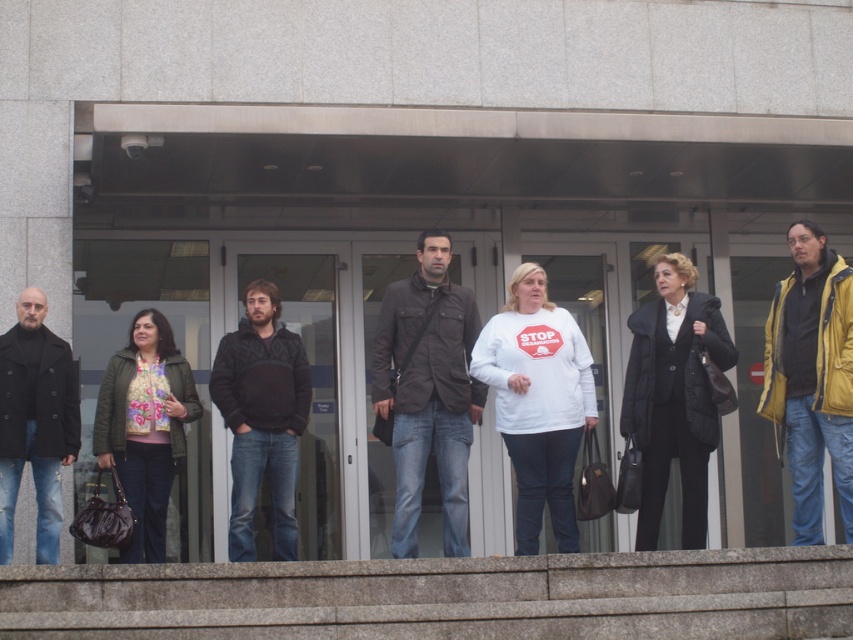
Question: Among these points, which one is nearest to the camera?

Choices:
 (A) (242, 435)
 (B) (131, 362)
 (C) (779, 332)

Answer: (C)

Question: Is matte brown jacket at center positioned before floral-patterned fabric top at center?

Choices:
 (A) no
 (B) yes

Answer: (A)

Question: Which point appears farthest from the camera in this image?

Choices:
 (A) (556, 500)
 (B) (134, 436)
 (C) (4, 396)
 (D) (271, 316)

Answer: (D)

Question: Can you confirm if black fleece at center is positioned below black wool coat at left?

Choices:
 (A) no
 (B) yes

Answer: (B)

Question: Based on their relative distances, which object is nearer to the black fleece at center?

Choices:
 (A) floral-patterned fabric top at center
 (B) yellow matte jacket at right
 (C) matte brown jacket at center
 (D) black wool coat at left

Answer: (A)

Question: Is black fleece at center positioned in front of floral-patterned fabric top at center?

Choices:
 (A) no
 (B) yes

Answer: (A)